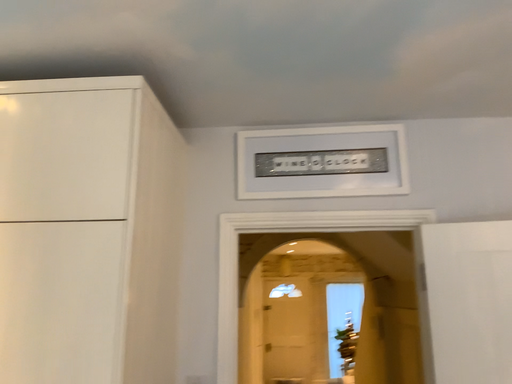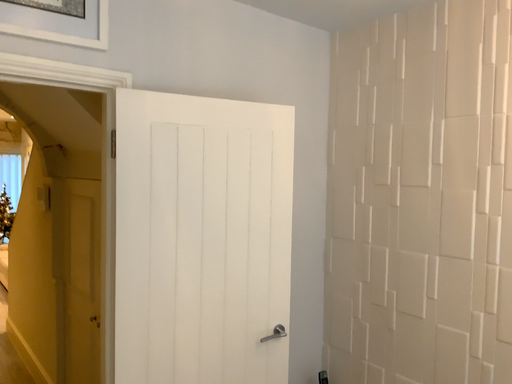
Question: Which way did the camera rotate in the video?

Choices:
 (A) rotated right
 (B) rotated left

Answer: (A)